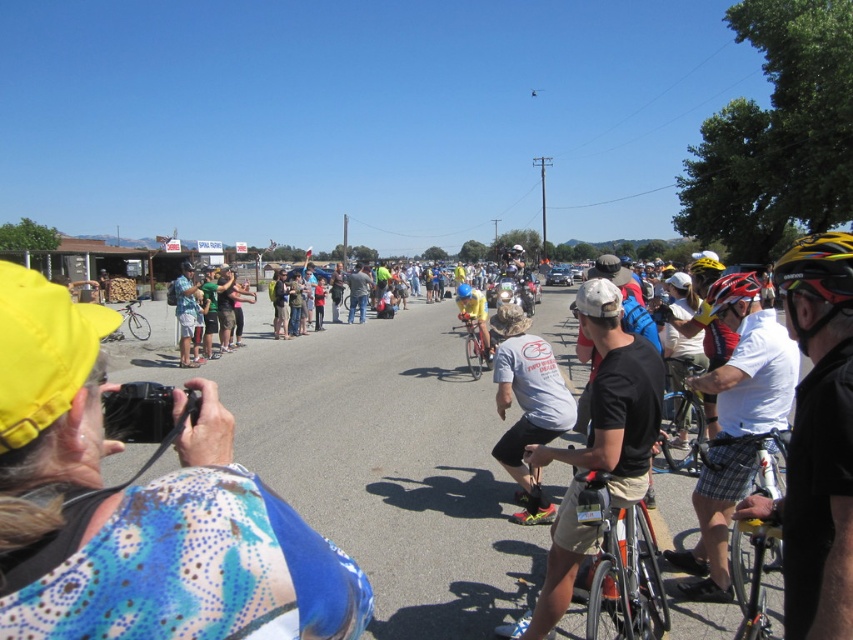
You are a drone operator trying to capture aerial footage of the cycling event. You notice two points in the image labeled as point 1 at coordinates point (479, 339) and point 2 at coordinates point (128, 307). Which point should you prioritize for a closer shot to ensure the camera is focused on the main action area?

Point 1 at coordinates point (479, 339) should be prioritized because it is closer to the camera than point 2 at coordinates point (128, 307), making it easier to capture the main action area in focus.